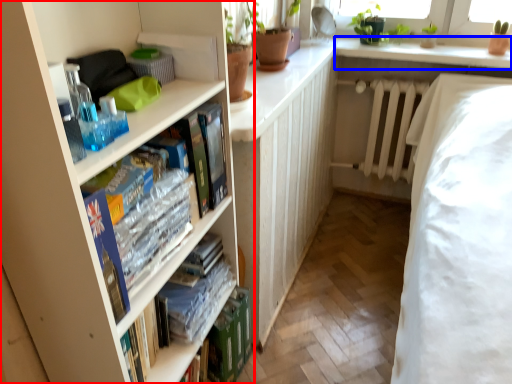
Question: Which point is closer to the camera, bookcase (highlighted by a red box) or window sill (highlighted by a blue box)?

Choices:
 (A) bookcase
 (B) window sill

Answer: (A)